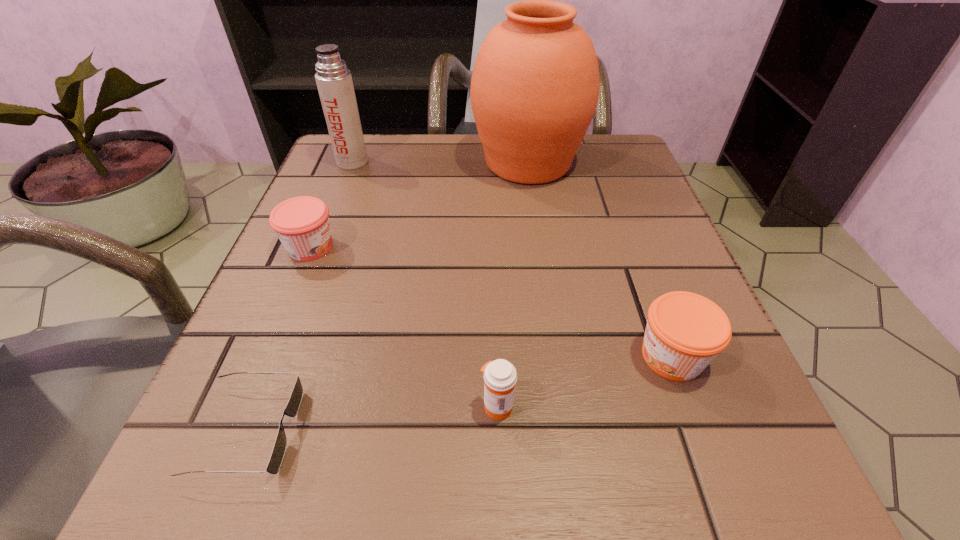
Locate an element on the screen. This screenshot has width=960, height=540. unoccupied area between the shortest object and the medicine is located at coordinates (372, 418).

This screenshot has height=540, width=960. Identify the location of the closest object relative to the right jam. (500, 376).

Image resolution: width=960 pixels, height=540 pixels. What are the coordinates of `object identified as the fifth closest to the second tallest object` in the screenshot? It's located at (685, 331).

Locate an element on the screen. Image resolution: width=960 pixels, height=540 pixels. free space that satisfies the following two spatial constraints: 1. on the back side of the medicine; 2. on the front label of the fourth nearest object is located at coordinates (492, 247).

Locate an element on the screen. The image size is (960, 540). vacant space that satisfies the following two spatial constraints: 1. on the front label of the left jam; 2. on the back side of the medicine is located at coordinates pyautogui.click(x=245, y=406).